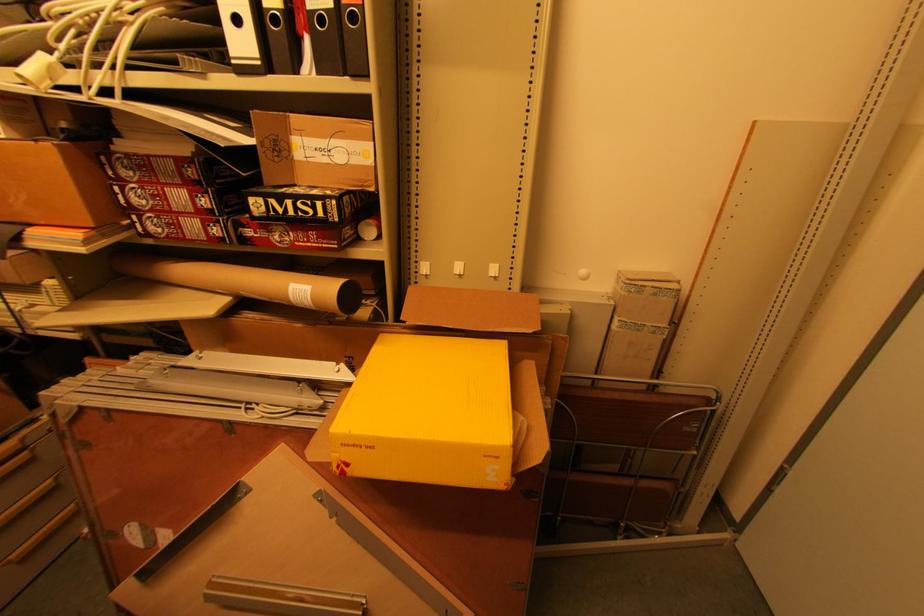
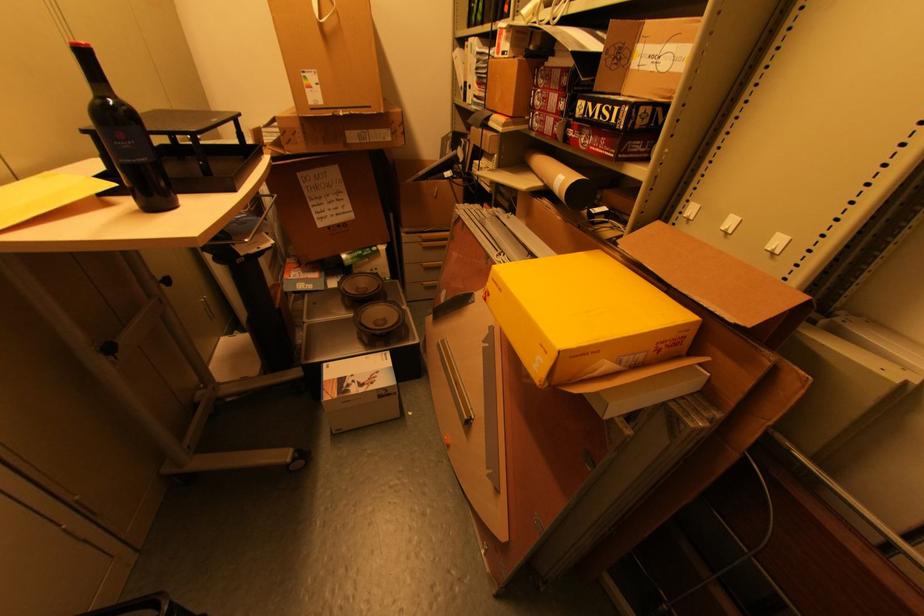
Based on the continuous images, in which direction is the camera rotating?

The camera rotated toward left-down.